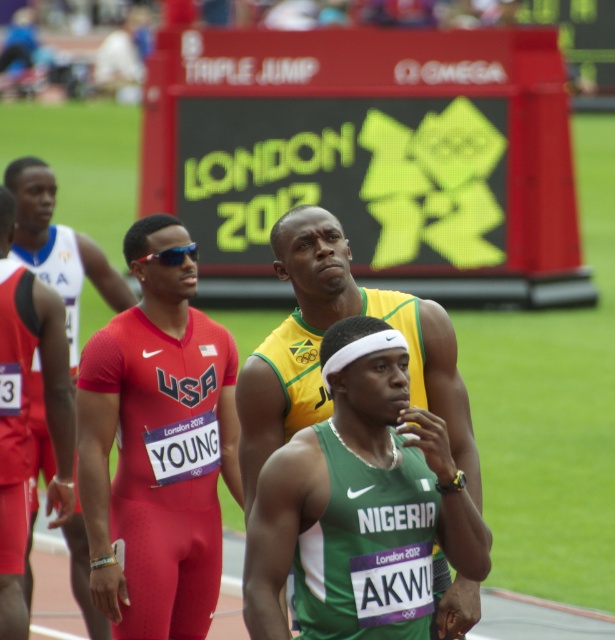
You are a photographer at the London 2012 Olympics. You need to capture a photo of both the green jersey at center and the red matte uniform at center. According to the scene, which athlete should you position your camera to the left of to ensure both are in frame?

You should position your camera to the left of the green jersey at center because the green jersey at center is to the right of the red matte uniform at center, so placing the camera to the left of the green jersey at center will allow both athletes to be captured in the frame.

You are a photographer at the London 2012 Olympics. You need to capture a photo of both the green jersey at center and the red matte uniform at center. Which athlete should you focus on first to ensure their entire body fits in the frame if your camera has a fixed width?

The green jersey at center has a greater width than the red matte uniform at center. To ensure both fit in the frame, focus on the green jersey at center first since it requires more space.

Looking at this image, you are a photographer standing at the starting line of the track, and you want to take a photo of the point at coordinates (87, 408). If you need to be within 10 meters to capture it clearly, can you take the photo from your current position?

The point at coordinates (87, 408) is 9.54 meters away from you, so yes, you can take the photo from your current position since it is within the 10 meters range.